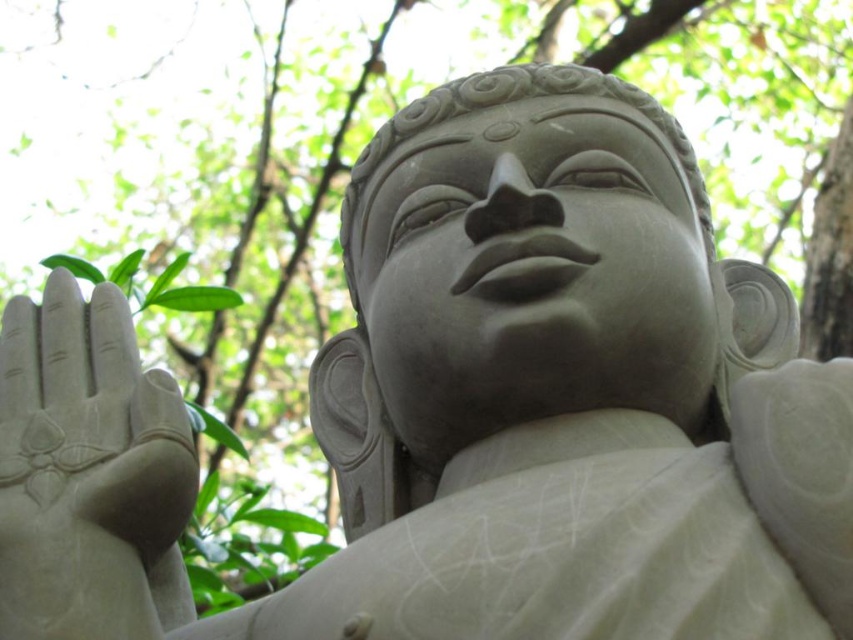
Looking at this image, you are an art conservator examining the stone statue. You notice a small point at coordinates (88, 474). Based on the statue description, where is this point located?

The point at coordinates (88, 474) is on the smooth stone hand at left.

Consider the image. You are an art conservator examining the statue. You notice the smooth stone hand at left and the gray stone statue at center. Which object is positioned lower in the image?

The smooth stone hand at left is positioned below the gray stone statue at center, so it is lower in the image.